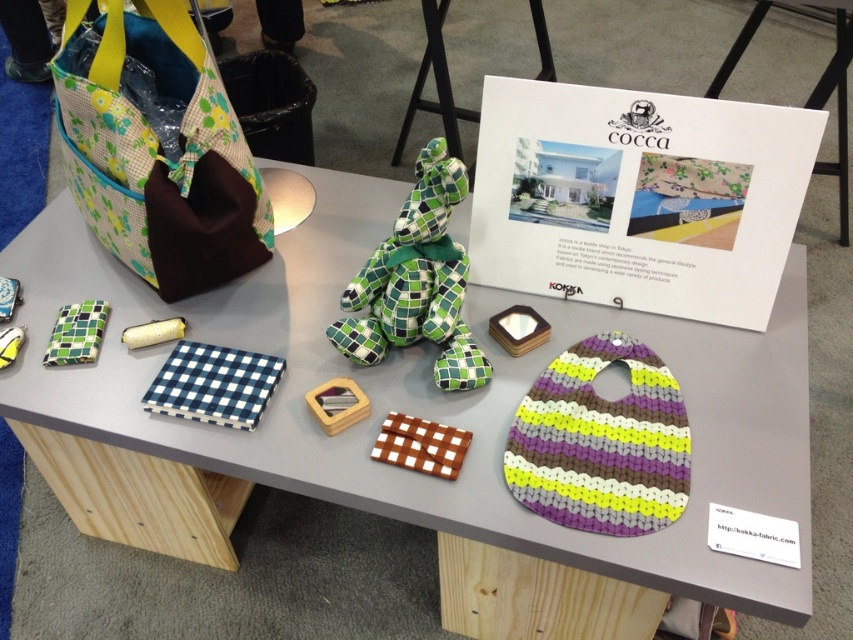
Looking at this image, is green checkered fabric stuffed animal at center smaller than yellow fabric toy at center?

No.

Can you confirm if green checkered fabric stuffed animal at center is wider than yellow fabric toy at center?

Correct, the width of green checkered fabric stuffed animal at center exceeds that of yellow fabric toy at center.

Which is in front, point (431, 269) or point (1, 364)?

Point (431, 269) is in front.

This screenshot has height=640, width=853. Identify the location of green checkered fabric stuffed animal at center. (416, 282).

Is knitted fabric bib at center closer to the viewer compared to blue checkered fabric at center?

Yes, it is.

Can you confirm if knitted fabric bib at center is positioned above blue checkered fabric at center?

No, knitted fabric bib at center is not above blue checkered fabric at center.

Does point (651, 484) come closer to viewer compared to point (253, 396)?

Yes, it is in front of point (253, 396).

Where is `knitted fabric bib at center`? knitted fabric bib at center is located at coordinates (601, 442).

How distant is yellow fabric roll at center from yellow fabric toy at center?

6.84 inches

Can you confirm if yellow fabric roll at center is shorter than yellow fabric toy at center?

Yes, yellow fabric roll at center is shorter than yellow fabric toy at center.

Which is in front, point (132, 326) or point (15, 342)?

Positioned in front is point (15, 342).

Locate an element on the screen. This screenshot has width=853, height=640. yellow fabric roll at center is located at coordinates (154, 332).